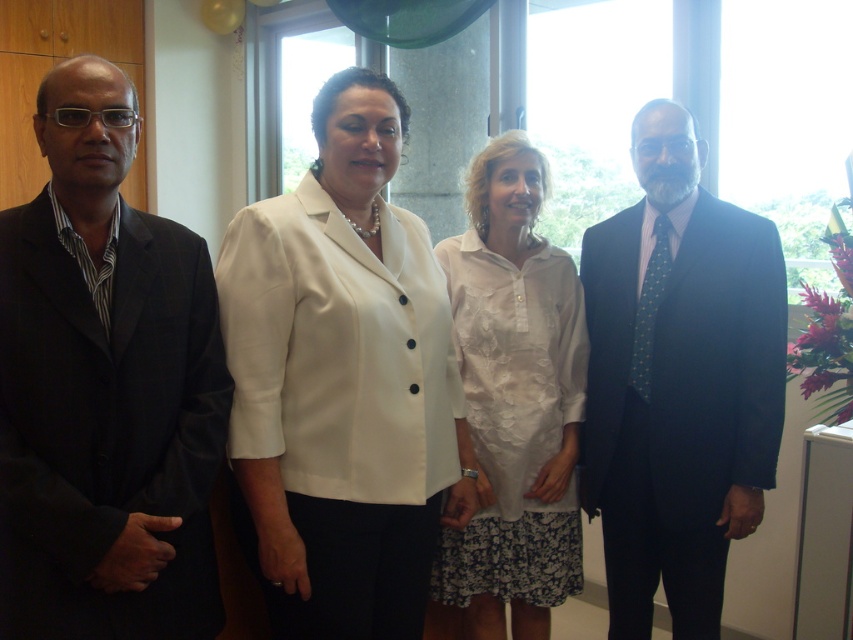
Question: Estimate the real-world distances between objects in this image. Which object is farther from the white matte blazer at center?

Choices:
 (A) matte black suit at left
 (B) white lace dress at center

Answer: (B)

Question: Which point is closer to the camera?

Choices:
 (A) (521, 339)
 (B) (409, 250)

Answer: (B)

Question: Does matte black suit at left have a smaller size compared to white matte blazer at center?

Choices:
 (A) yes
 (B) no

Answer: (A)

Question: Does white matte blazer at center appear on the right side of white lace dress at center?

Choices:
 (A) no
 (B) yes

Answer: (A)

Question: Among these points, which one is farthest from the camera?

Choices:
 (A) (711, 456)
 (B) (502, 438)

Answer: (B)

Question: Is matte black suit at left positioned at the back of white lace dress at center?

Choices:
 (A) no
 (B) yes

Answer: (A)